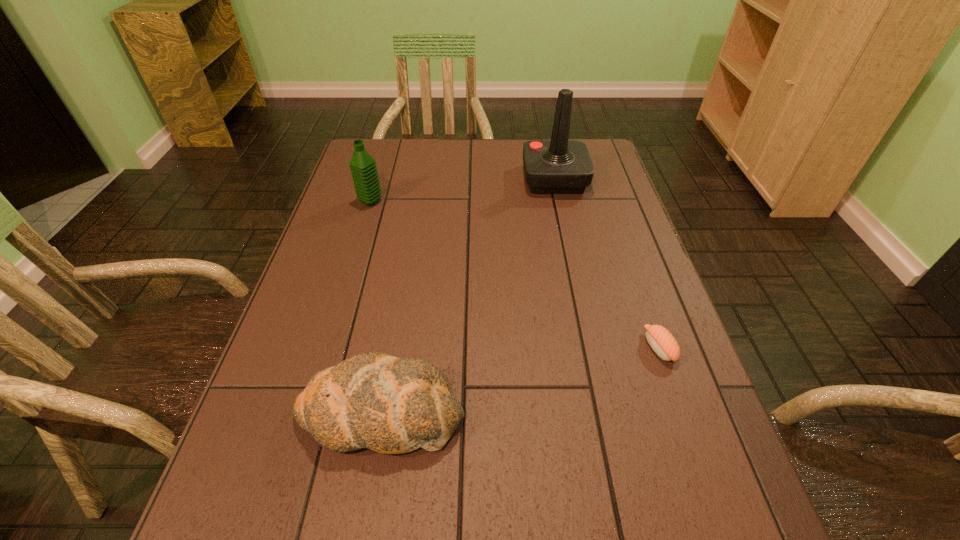
In order to click on vacant area that lies between the third tallest object and the third farthest object in this screenshot , I will do `click(520, 380)`.

Identify which object is the third closest to the second shortest object. Please provide its 2D coordinates. Your answer should be formatted as a tuple, i.e. [(x, y)], where the tuple contains the x and y coordinates of a point satisfying the conditions above.

[(557, 166)]

Choose which object is the second nearest neighbor to the third tallest object. Please provide its 2D coordinates. Your answer should be formatted as a tuple, i.e. [(x, y)], where the tuple contains the x and y coordinates of a point satisfying the conditions above.

[(363, 167)]

Find the location of `free spot that satisfies the following two spatial constraints: 1. on the front side of the nearest object; 2. on the right side of the water bottle`. free spot that satisfies the following two spatial constraints: 1. on the front side of the nearest object; 2. on the right side of the water bottle is located at coordinates (307, 413).